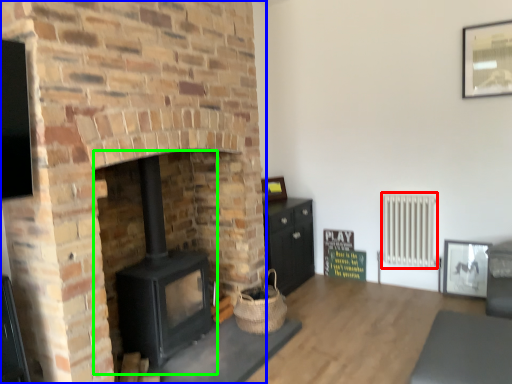
Question: Considering the real-world distances, which object is farthest from radiator (highlighted by a red box)? fireplace (highlighted by a blue box) or wood burning stove (highlighted by a green box)?

Choices:
 (A) fireplace
 (B) wood burning stove

Answer: (B)